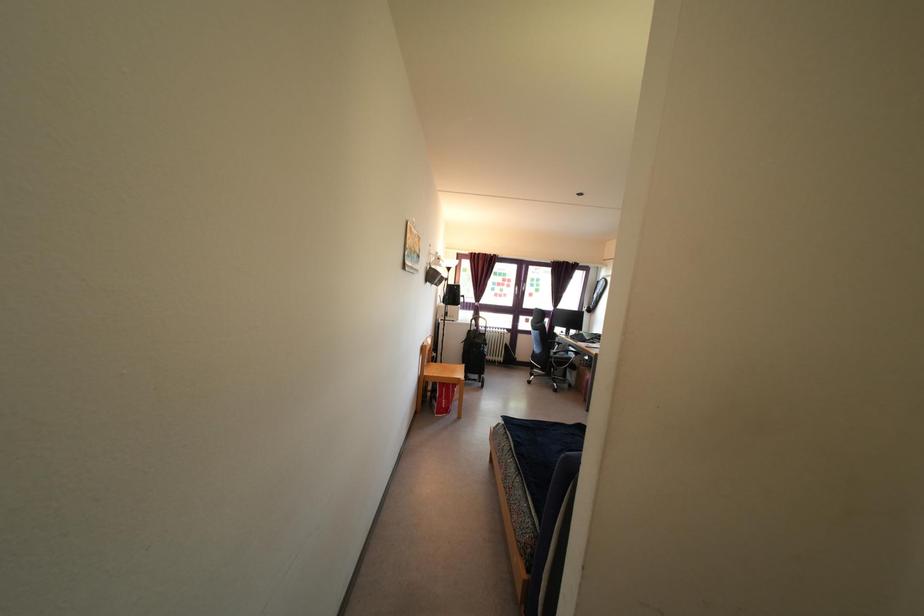
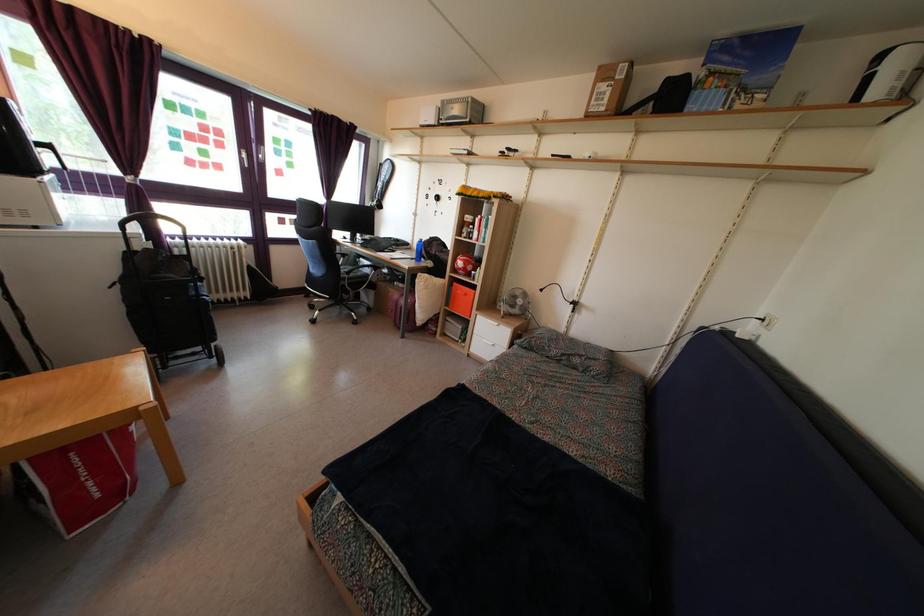
Locate, in the second image, the point that corresponds to pixel 557 362 in the first image.

(350, 282)